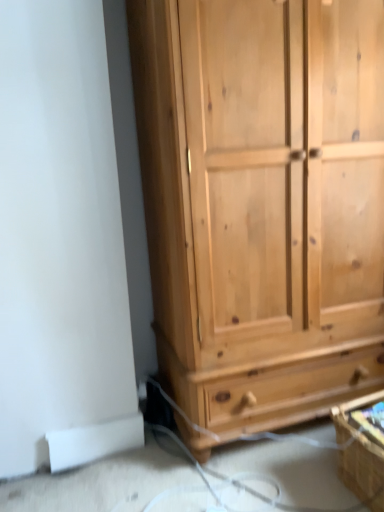
I want to click on wooden basket at lower right, so click(x=362, y=447).

In order to face wooden basket at lower right, should I rotate leftwards or rightwards?

Rotate right and turn 24.284 degrees.

This screenshot has width=384, height=512. Describe the element at coordinates (362, 447) in the screenshot. I see `wooden basket at lower right` at that location.

You are a GUI agent. You are given a task and a screenshot of the screen. Output one action in this format:
    pyautogui.click(x=<x>, y=<y>)
    Task: Click on the wooden basket at lower right
    This screenshot has width=384, height=512.
    Given the screenshot: What is the action you would take?
    pyautogui.click(x=362, y=447)